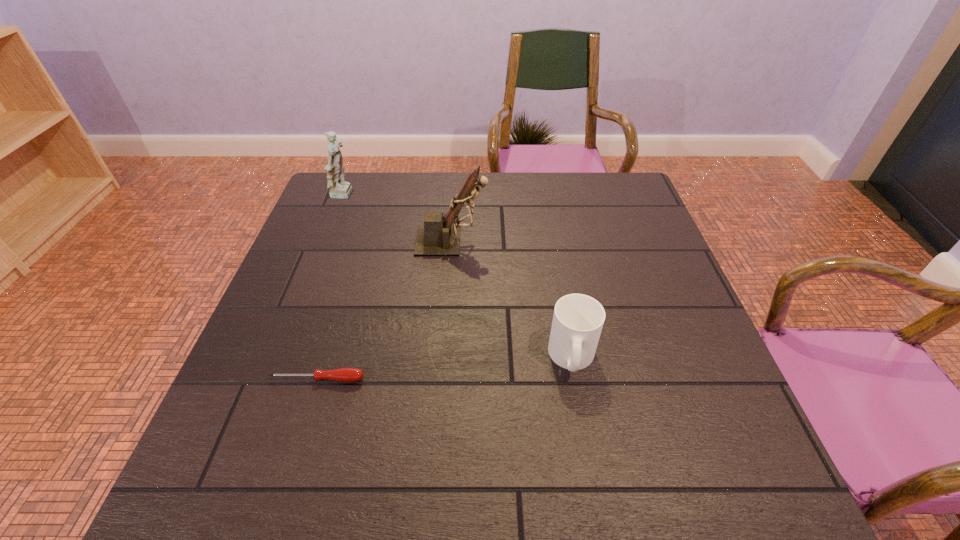
Identify the location of the second object from right to left. This screenshot has width=960, height=540. (437, 237).

Identify the location of the second farthest object. (437, 237).

Image resolution: width=960 pixels, height=540 pixels. In order to click on the farthest object in this screenshot , I will do pos(338,188).

Locate an element on the screen. The height and width of the screenshot is (540, 960). the farther figurine is located at coordinates (338, 188).

Identify the location of mug. (x=578, y=319).

Where is `the rightmost object`? Image resolution: width=960 pixels, height=540 pixels. the rightmost object is located at coordinates (578, 319).

Where is `the shortest object`? the shortest object is located at coordinates (348, 375).

The width and height of the screenshot is (960, 540). Find the location of `vacant region located 0.180m on the front-facing side of the nearer figurine`. vacant region located 0.180m on the front-facing side of the nearer figurine is located at coordinates (553, 241).

Identify the location of vacant area situated on the front-facing side of the farther figurine. (425, 196).

You are a GUI agent. You are given a task and a screenshot of the screen. Output one action in this format:
    pyautogui.click(x=<x>, y=<y>)
    Task: Click on the vacant region located 0.220m on the handle side of the third tallest object
    The height and width of the screenshot is (540, 960).
    Given the screenshot: What is the action you would take?
    pyautogui.click(x=598, y=500)